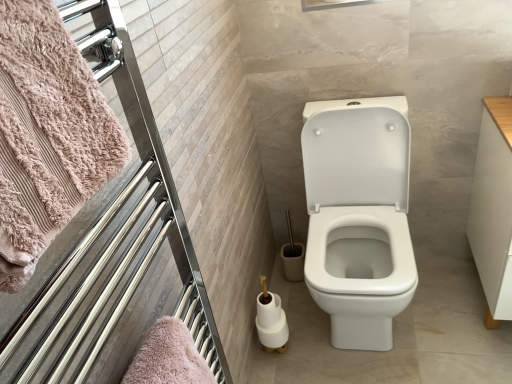
Question: Considering the positions of point (482, 157) and point (265, 336), is point (482, 157) closer or farther from the camera than point (265, 336)?

Choices:
 (A) closer
 (B) farther

Answer: (B)

Question: Considering the positions of white wood drawer at right and white glossy toilet paper at lower center, the 2th toilet paper in the top-to-bottom sequence, in the image, is white wood drawer at right taller or shorter than white glossy toilet paper at lower center, the 2th toilet paper in the top-to-bottom sequence,?

Choices:
 (A) short
 (B) tall

Answer: (B)

Question: Which object is positioned closest to the white glossy toilet paper at lower center, which is counted as the first toilet paper, starting from the bottom?

Choices:
 (A) chrome metallic towel rack at upper left
 (B) pink fluffy towel at left
 (C) white wood drawer at right
 (D) white glossy toilet paper at lower center, placed as the 2th toilet paper when sorted from bottom to top

Answer: (D)

Question: Which object is the closest to the pink fluffy towel at left?

Choices:
 (A) white glossy toilet paper at lower center, placed as the 2th toilet paper when sorted from bottom to top
 (B) chrome metallic towel rack at upper left
 (C) white glossy toilet paper at lower center, which is counted as the first toilet paper, starting from the bottom
 (D) white wood drawer at right

Answer: (B)